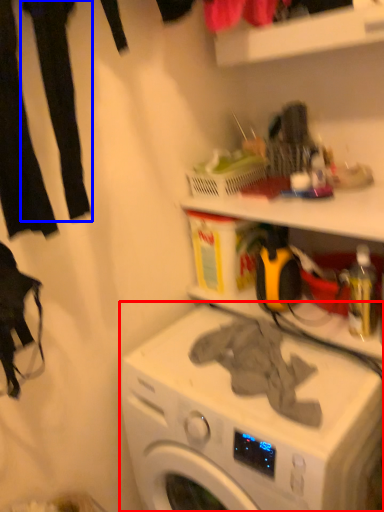
Question: Which object is closer to the camera taking this photo, washing machine (highlighted by a red box) or clothing (highlighted by a blue box)?

Choices:
 (A) washing machine
 (B) clothing

Answer: (B)